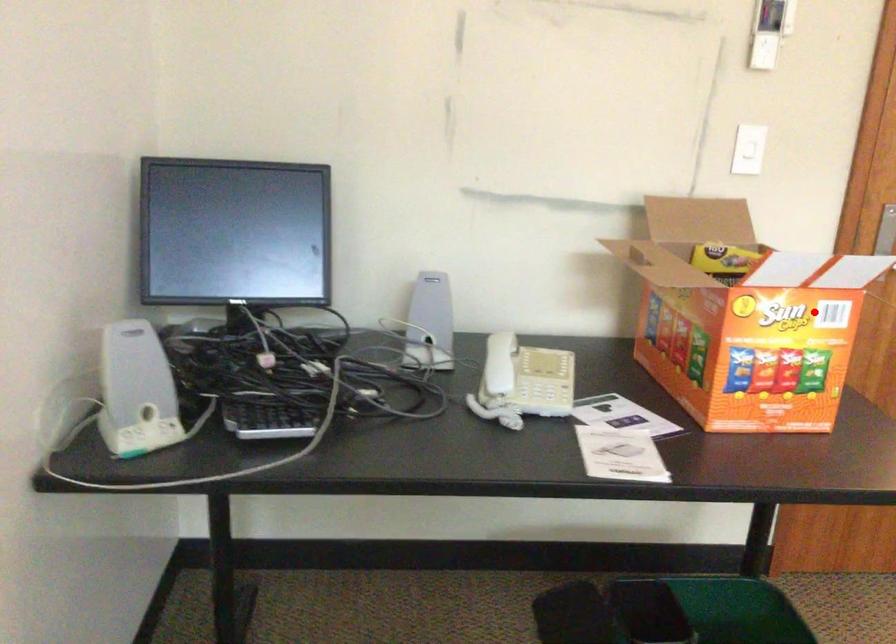
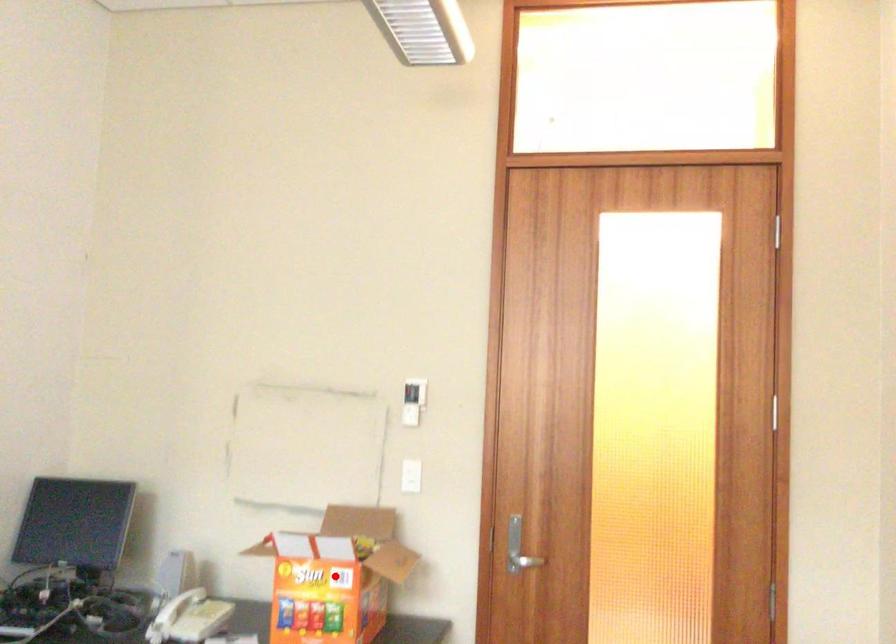
I am providing you with two images of the same scene from different viewpoints. A red point is marked on the first image and another point is marked on the second image. Is the marked point in image1 the same physical position as the marked point in image2?

Yes